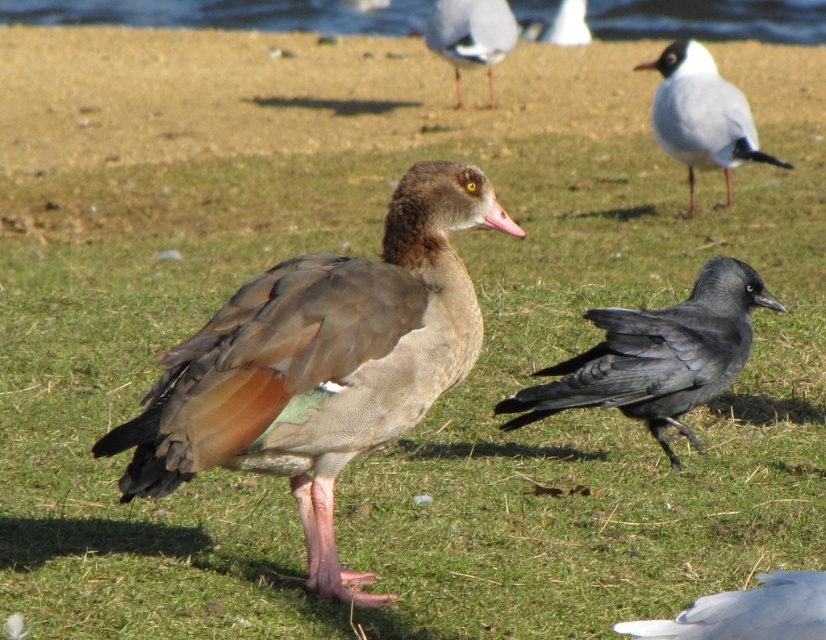
Question: Is the position of white glossy seagull at upper right more distant than that of white glossy seagull at upper center?

Choices:
 (A) no
 (B) yes

Answer: (A)

Question: Estimate the real-world distances between objects in this image. Which object is closer to the white glossy seagull at upper center?

Choices:
 (A) white glossy seagull at upper right
 (B) pink matte beak at center
 (C) shiny black crow at right
 (D) brown feathered duck at center

Answer: (A)

Question: In this image, where is brown feathered duck at center located relative to white glossy seagull at upper right?

Choices:
 (A) below
 (B) above

Answer: (A)

Question: Which object appears farthest from the camera in this image?

Choices:
 (A) white glossy seagull at upper right
 (B) brown feathered duck at center
 (C) shiny black crow at right

Answer: (A)

Question: Which of these objects is positioned closest to the white glossy seagull at upper center?

Choices:
 (A) brown feathered duck at center
 (B) pink matte beak at center
 (C) shiny black crow at right

Answer: (C)

Question: Considering the relative positions of shiny black crow at right and clear water at upper center in the image provided, where is shiny black crow at right located with respect to clear water at upper center?

Choices:
 (A) right
 (B) left

Answer: (A)